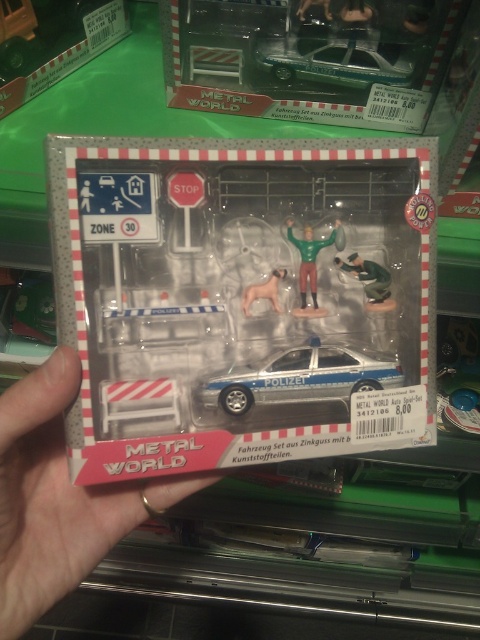
Question: Which of the following is the farthest from the observer?

Choices:
 (A) (46, 534)
 (B) (335, 380)
 (C) (363, 38)

Answer: (C)

Question: Is silver metallic car at center positioned behind metallic silver police car at upper center?

Choices:
 (A) yes
 (B) no

Answer: (B)

Question: Does metallic silver police car at upper center have a lesser width compared to matte plastic dog at center?

Choices:
 (A) no
 (B) yes

Answer: (A)

Question: Among these points, which one is farthest from the camera?

Choices:
 (A) (241, 304)
 (B) (290, 221)
 (C) (377, 268)
 (D) (339, 52)

Answer: (D)

Question: Is metallic silver police car at upper center smaller than matte plastic dog at center?

Choices:
 (A) no
 (B) yes

Answer: (A)

Question: Which point is closer to the camera?

Choices:
 (A) (251, 371)
 (B) (264, 48)
 (C) (167, 508)
 (D) (247, 307)

Answer: (C)